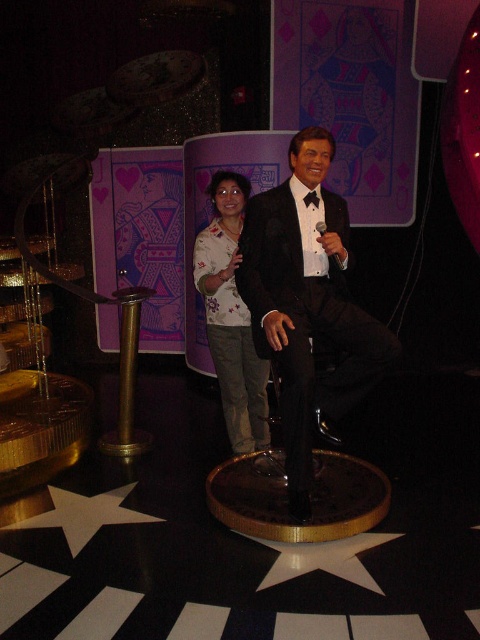
You are planning to place a decorative item between the shiny black suit at center and the floral shirt at center. Considering their widths, which one should the item be closer to ensure it doesn

The shiny black suit at center is wider than the floral shirt at center, so the decorative item should be placed closer to the floral shirt at center to balance the space between them.

You are standing in the themed venue and want to take a photo of both the shiny black suit at center and the floral shirt at center. Which one should you position closer to the left side of your camera frame to include both in the photo?

The shiny black suit at center is positioned on the right side of floral shirt at center, so to include both in the photo, you should position the floral shirt at center closer to the left side of your camera frame.